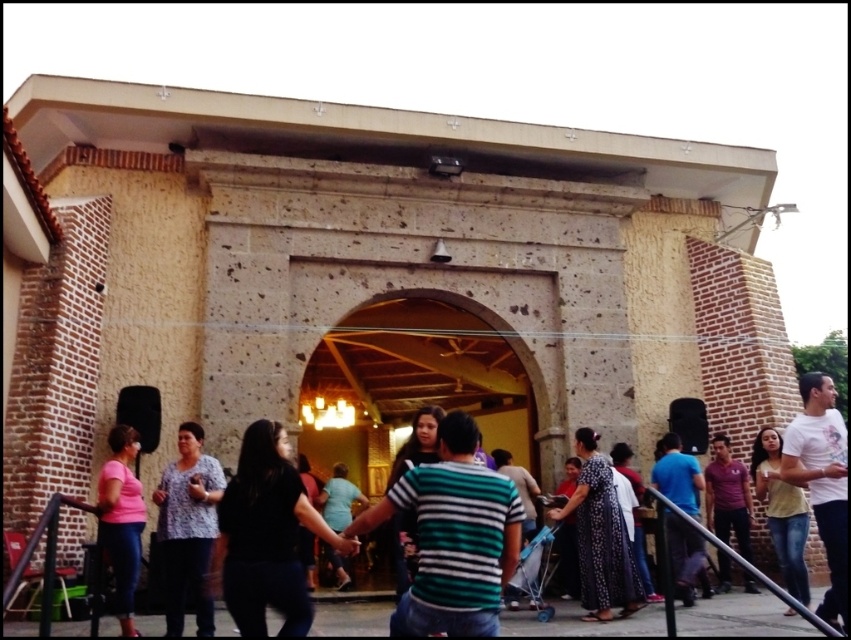
You are standing in front of the stone building and want to take a photo of both the point at coordinates point [597,467] and point [343,504]. Which point should you focus on first to ensure both are in clear view?

You should focus on point [597,467] first because it is closer to the camera than point [343,504], ensuring both points are in focus when using a camera with a fixed focal length.

You are organizing a photo shoot and need to arrange two shirts for a display. The striped cotton shirt at center and the black striped shirt at center must be placed on a mannequin. Which shirt should be placed on the top rack if the smaller one needs to be displayed higher?

The striped cotton shirt at center should be placed on the top rack because it is smaller compared to the black striped shirt at center.